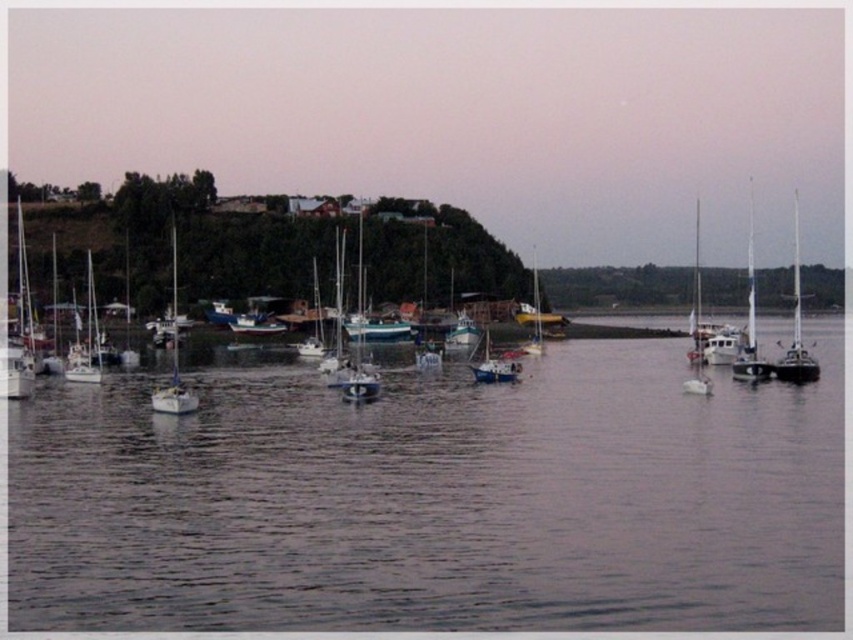
You are a harbor worker who needs to guide a new boat into the harbor. You see the white matte sailboat at right and the shiny blue sailboat at center. Which boat should you move to make space for the new arrival?

The white matte sailboat at right is positioned on the right side of the shiny blue sailboat at center. To make space for the new arrival, you should move the shiny blue sailboat at center since it is closer to the center where the new boat would likely enter.

You are standing on the dock and want to board the white matte sailboat at center. However, there is another white matte sailboat at left blocking your path. Can you walk around it to reach your destination?

The white matte sailboat at left is 80.71 feet away from the white matte sailboat at center, so there is enough space between them for you to walk around the white matte sailboat at left and reach the white matte sailboat at center.

You are a photographer planning to take a photo of the harbor scene. You want to ensure both the white matte sailboat at left and the white matte sailboat at center are clearly visible in the frame. Considering their heights, which sailboat should be placed closer to the foreground to avoid one blocking the other?

The white matte sailboat at left is taller than the white matte sailboat at center. To prevent the taller boat from blocking the shorter one, position the taller white matte sailboat at left closer to the foreground so the shorter one remains visible in the background.